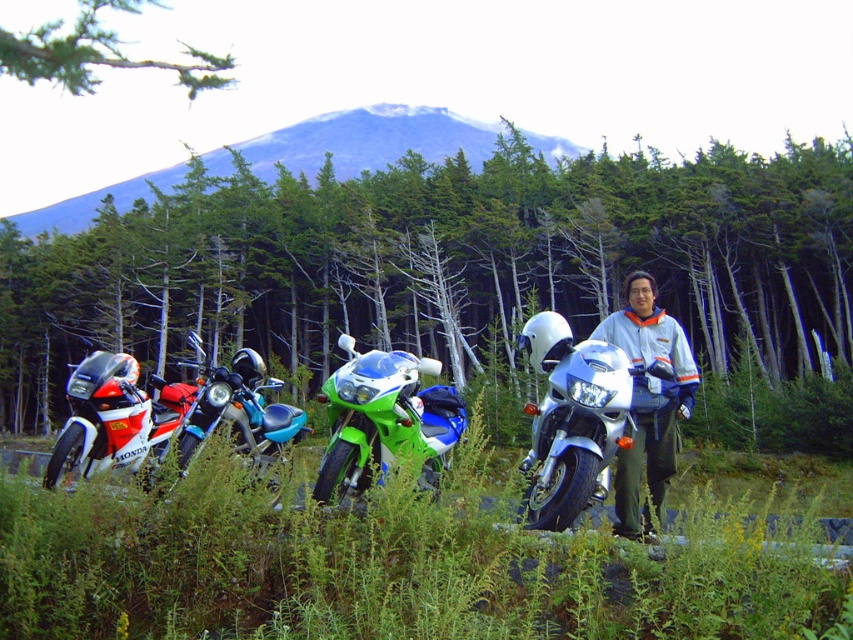
Is green matte tree at center smaller than shiny red motorcycle at left?

No.

Where is `green matte tree at center`? green matte tree at center is located at coordinates (438, 259).

Where is `green glossy sportbike at center`? green glossy sportbike at center is located at coordinates (383, 420).

Is green glossy sportbike at center above shiny red motorcycle at left?

No.

Is point (425, 476) positioned in front of point (79, 380)?

Yes, it is.

Find the location of a particular element. The height and width of the screenshot is (640, 853). green glossy sportbike at center is located at coordinates (383, 420).

Does white glossy motorcycle at center lie in front of shiny metallic motorcycle at left?

Yes, it is in front of shiny metallic motorcycle at left.

The width and height of the screenshot is (853, 640). Describe the element at coordinates (581, 419) in the screenshot. I see `white glossy motorcycle at center` at that location.

Identify the location of white glossy motorcycle at center. point(581,419).